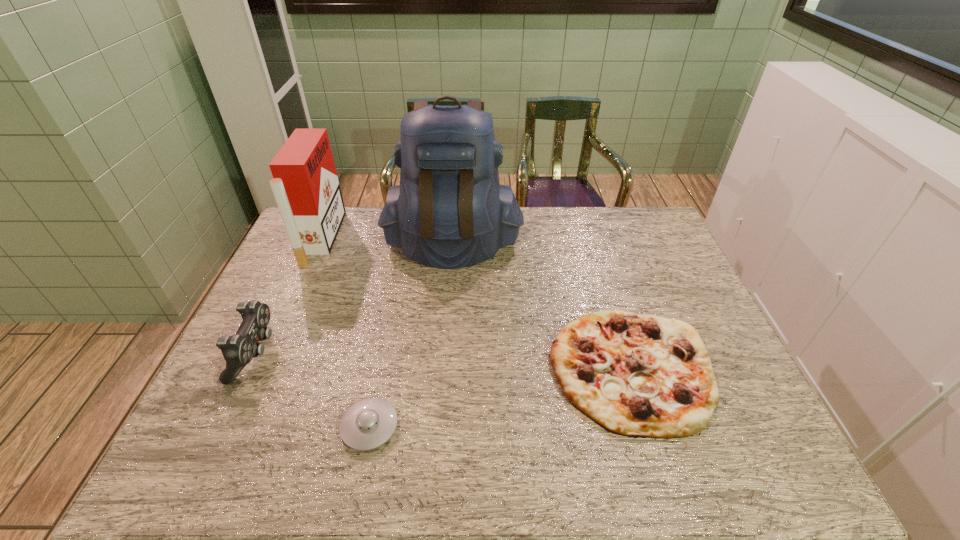
Image resolution: width=960 pixels, height=540 pixels. Identify the location of free spot between the tallest object and the control. point(354,299).

This screenshot has height=540, width=960. I want to click on empty space between the shortest object and the third tallest object, so click(x=313, y=390).

At what (x,y) coordinates should I click in order to perform the action: click on vacant space that's between the saucer and the tallest object. Please return your answer as a coordinate pair (x, y). Looking at the image, I should click on (411, 335).

In order to click on the second closest object to the shortest object in this screenshot , I will do `click(634, 375)`.

Where is `object that stands as the fourth closest to the shortest object`? This screenshot has height=540, width=960. object that stands as the fourth closest to the shortest object is located at coordinates (306, 188).

At what (x,y) coordinates should I click in order to perform the action: click on blank area in the image that satisfies the following two spatial constraints: 1. on the front-facing side of the second tallest object; 2. on the right side of the saucer. Please return your answer as a coordinate pair (x, y). The height and width of the screenshot is (540, 960). Looking at the image, I should click on (239, 427).

Where is `free region that satisfies the following two spatial constraints: 1. at the front pocket of the backpack; 2. on the right side of the rightmost object`? free region that satisfies the following two spatial constraints: 1. at the front pocket of the backpack; 2. on the right side of the rightmost object is located at coordinates (443, 368).

I want to click on vacant point that satisfies the following two spatial constraints: 1. on the surface of the control with buttons; 2. on the left side of the shortest object, so click(x=221, y=427).

Where is `free space that satisfies the following two spatial constraints: 1. at the front pocket of the tallest object; 2. on the surface of the third tallest object with buttons`? The image size is (960, 540). free space that satisfies the following two spatial constraints: 1. at the front pocket of the tallest object; 2. on the surface of the third tallest object with buttons is located at coordinates (444, 354).

You are a GUI agent. You are given a task and a screenshot of the screen. Output one action in this format:
    pyautogui.click(x=<x>, y=<y>)
    Task: Click on the vacant position in the image that satisfies the following two spatial constraints: 1. on the surface of the third shortest object with buttons; 2. on the right side of the rightmost object
    This screenshot has width=960, height=540.
    Given the screenshot: What is the action you would take?
    pyautogui.click(x=249, y=368)